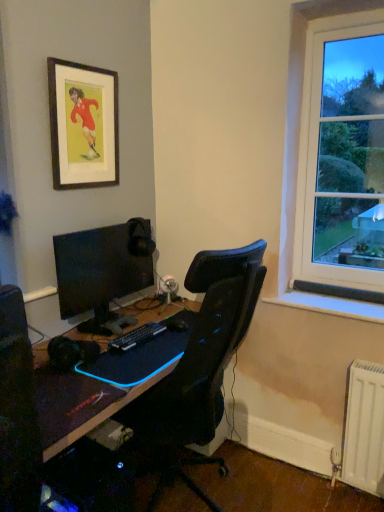
Question: Which is correct: black matte desk at center is inside black plastic keyboard at center, or outside of it?

Choices:
 (A) outside
 (B) inside

Answer: (A)

Question: Would you say black matte desk at center is to the left or to the right of black plastic keyboard at center in the picture?

Choices:
 (A) right
 (B) left

Answer: (B)

Question: Estimate the real-world distances between objects in this image. Which object is closer to the black plastic keyboard at center?

Choices:
 (A) black glossy monitor at left
 (B) wooden framed print at upper left
 (C) black matte desk at center
 (D) metallic silver speaker at center

Answer: (A)

Question: Considering the real-world distances, which object is closest to the black glossy monitor at left?

Choices:
 (A) wooden framed print at upper left
 (B) metallic silver speaker at center
 (C) black plastic keyboard at center
 (D) black matte desk at center

Answer: (C)